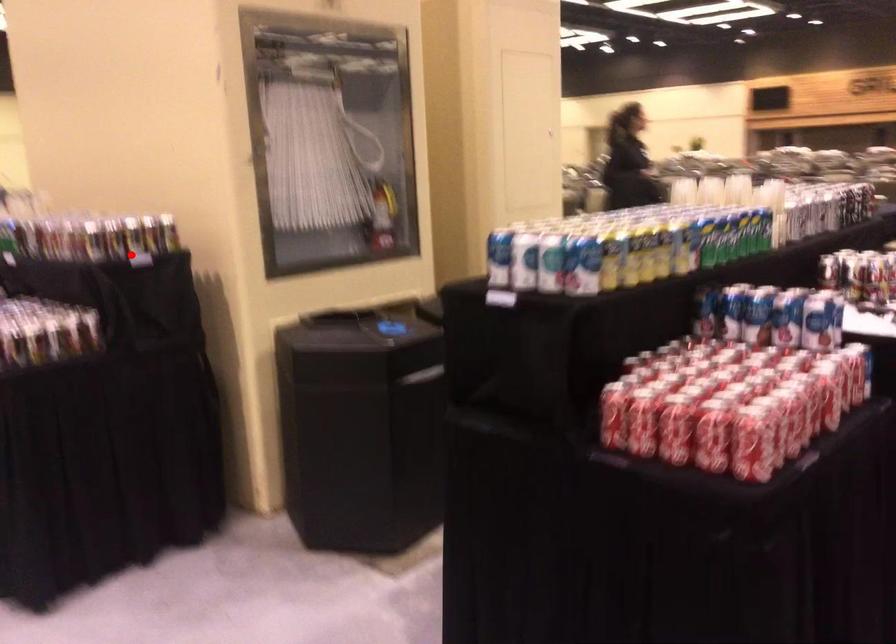
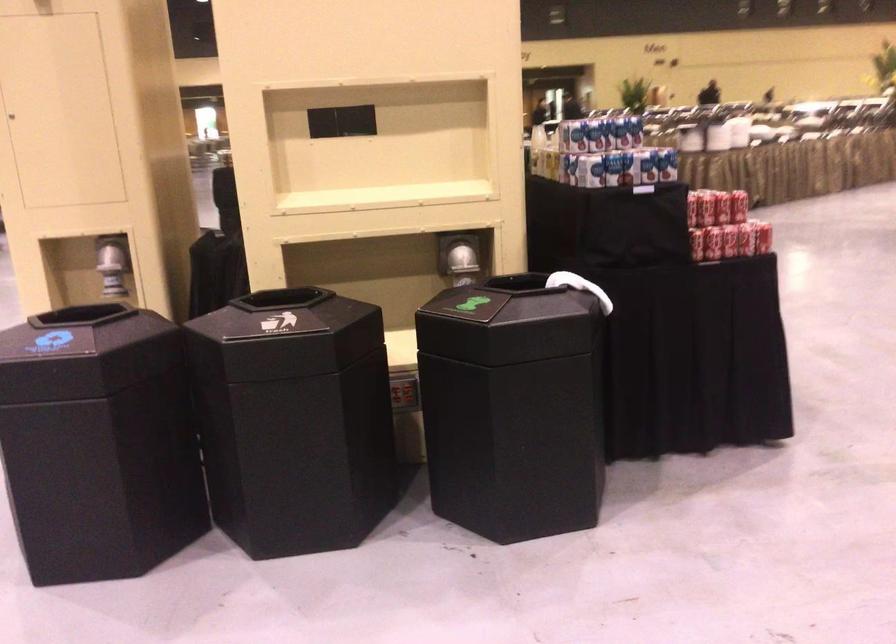
Question: I am providing you with two images of the same scene from different viewpoints. A red point is marked on the first image. Is the red point's position out of view in image 2?

Choices:
 (A) Yes
 (B) No

Answer: (A)